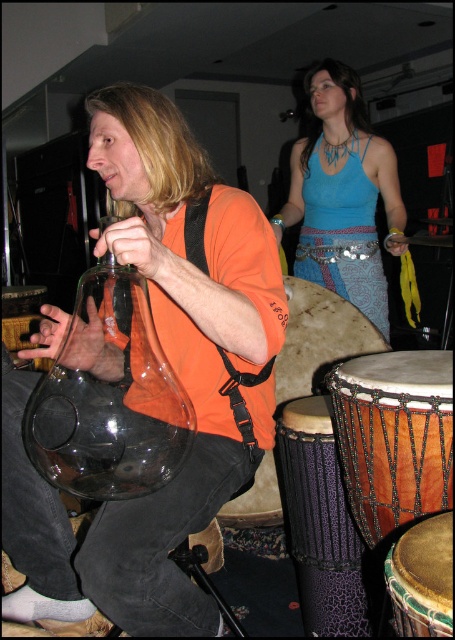
Which is behind, point (318, 70) or point (237, 502)?

The point (318, 70) is behind.

Is blue fabric top at upper center bigger than brown textured drum at lower center?

Yes.

Between point (338, 266) and point (232, 515), which one is positioned in front?

Point (232, 515) is more forward.

The height and width of the screenshot is (640, 455). In order to click on blue fabric top at upper center in this screenshot , I will do `click(342, 195)`.

Does blue fabric top at upper center have a greater height compared to brown textured drum at lower right?

Indeed, blue fabric top at upper center has a greater height compared to brown textured drum at lower right.

Who is positioned more to the right, blue fabric top at upper center or brown textured drum at lower right?

Positioned to the right is blue fabric top at upper center.

I want to click on blue fabric top at upper center, so click(x=342, y=195).

You are a GUI agent. You are given a task and a screenshot of the screen. Output one action in this format:
    pyautogui.click(x=<x>, y=<y>)
    Task: Click on the blue fabric top at upper center
    The image size is (455, 640).
    Given the screenshot: What is the action you would take?
    coord(342,195)

Is point (436, 577) farther from viewer compared to point (261, 525)?

No, it is not.

Does leather drum at lower right have a lesser height compared to brown textured drum at lower center?

Correct, leather drum at lower right is not as tall as brown textured drum at lower center.

Is point (435, 532) positioned after point (239, 496)?

No, it is in front of (239, 496).

This screenshot has width=455, height=640. What are the coordinates of `leather drum at lower right` in the screenshot? It's located at (421, 579).